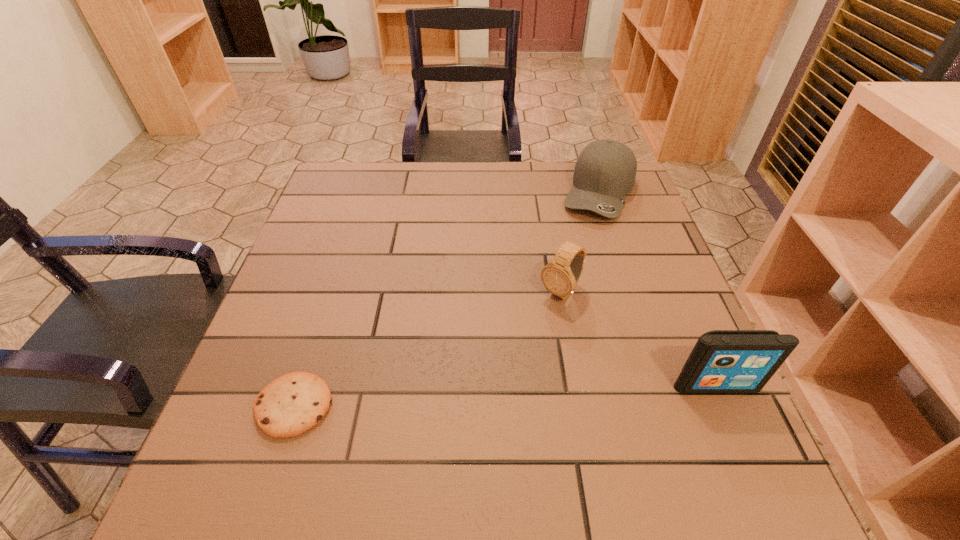
Identify the location of the leftmost object. (292, 404).

The height and width of the screenshot is (540, 960). What are the coordinates of `the shortest object` in the screenshot? It's located at (292, 404).

This screenshot has height=540, width=960. In order to click on iPod in this screenshot , I will do `click(722, 361)`.

Locate an element on the screen. the farthest object is located at coordinates (605, 171).

The image size is (960, 540). What are the coordinates of `the second farthest object` in the screenshot? It's located at (560, 276).

At what (x,y) coordinates should I click in order to perform the action: click on watch. Please return your answer as a coordinate pair (x, y). Looking at the image, I should click on (560, 276).

The width and height of the screenshot is (960, 540). In order to click on free space located 0.150m on the back of the cookie in this screenshot , I will do `click(324, 314)`.

Where is `free spot located on the front screen of the iPod`? Image resolution: width=960 pixels, height=540 pixels. free spot located on the front screen of the iPod is located at coordinates (740, 442).

Where is `free region located on the front brim of the farthest object`? free region located on the front brim of the farthest object is located at coordinates (561, 333).

Locate an element on the screen. The width and height of the screenshot is (960, 540). vacant space situated 0.400m on the front brim of the farthest object is located at coordinates (560, 336).